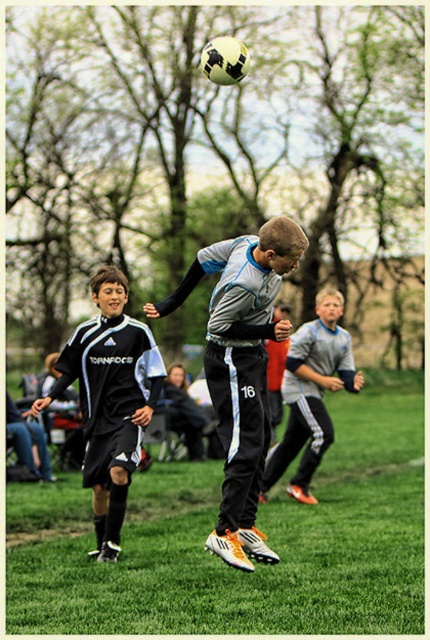
Question: Which object is the closest to the black matte soccer player at center?

Choices:
 (A) black adidas soccer uniform at left
 (B) gray/black athletic pants at center

Answer: (A)

Question: Which point is closer to the camera?

Choices:
 (A) black adidas soccer uniform at left
 (B) gray/black athletic pants at center

Answer: (A)

Question: Is black matte soccer player at center bigger than gray/black athletic pants at center?

Choices:
 (A) yes
 (B) no

Answer: (A)

Question: Which of these objects is positioned farthest from the black adidas soccer uniform at left?

Choices:
 (A) gray/black athletic pants at center
 (B) black matte soccer player at center

Answer: (A)

Question: Is black matte soccer player at center positioned behind gray/black athletic pants at center?

Choices:
 (A) no
 (B) yes

Answer: (A)

Question: Is black adidas soccer uniform at left above gray/black athletic pants at center?

Choices:
 (A) no
 (B) yes

Answer: (B)